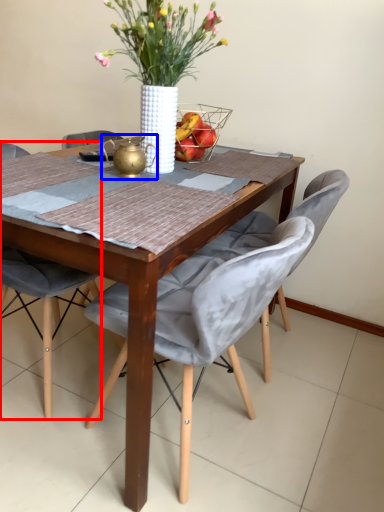
Question: Which object is further to the camera taking this photo, chair (highlighted by a red box) or tea pot (highlighted by a blue box)?

Choices:
 (A) chair
 (B) tea pot

Answer: (B)